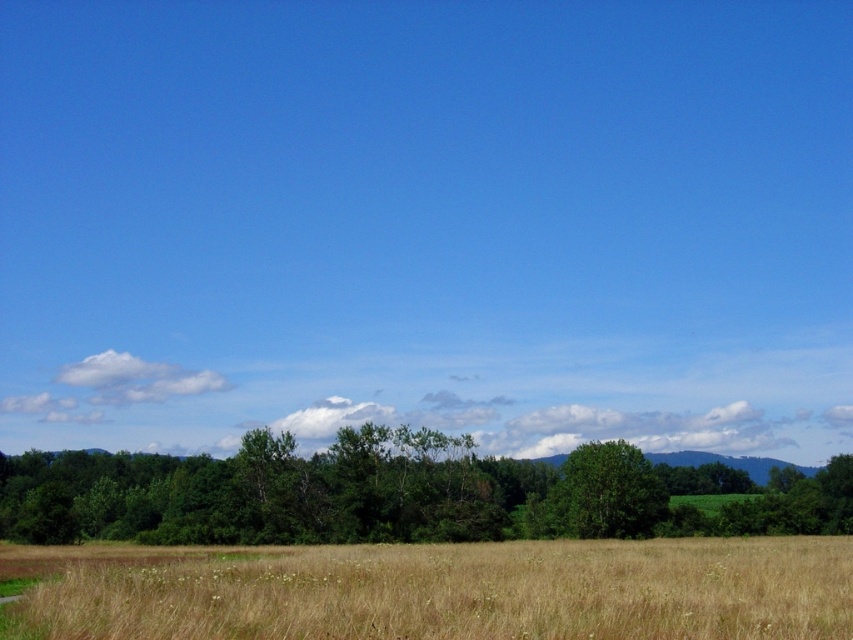
Between brown grassy field at lower center and green leafy tree at center, which one has more height?

With more height is green leafy tree at center.

Is point (593, 554) behind point (778, 472)?

No.

The height and width of the screenshot is (640, 853). I want to click on brown grassy field at lower center, so click(450, 592).

Who is lower down, brown grassy field at lower center or green matte tree at center?

green matte tree at center is below.

Who is more distant from viewer, (x=651, y=561) or (x=593, y=508)?

The point (x=593, y=508) is more distant.

The image size is (853, 640). In order to click on brown grassy field at lower center in this screenshot , I will do `click(450, 592)`.

Is green leafy tree at center above green matte tree at center?

Actually, green leafy tree at center is below green matte tree at center.

Is green leafy tree at center to the right of green matte tree at center from the viewer's perspective?

No, green leafy tree at center is not to the right of green matte tree at center.

Who is more distant from viewer, [196,474] or [582,534]?

Positioned behind is point [196,474].

The width and height of the screenshot is (853, 640). I want to click on green leafy tree at center, so click(396, 493).